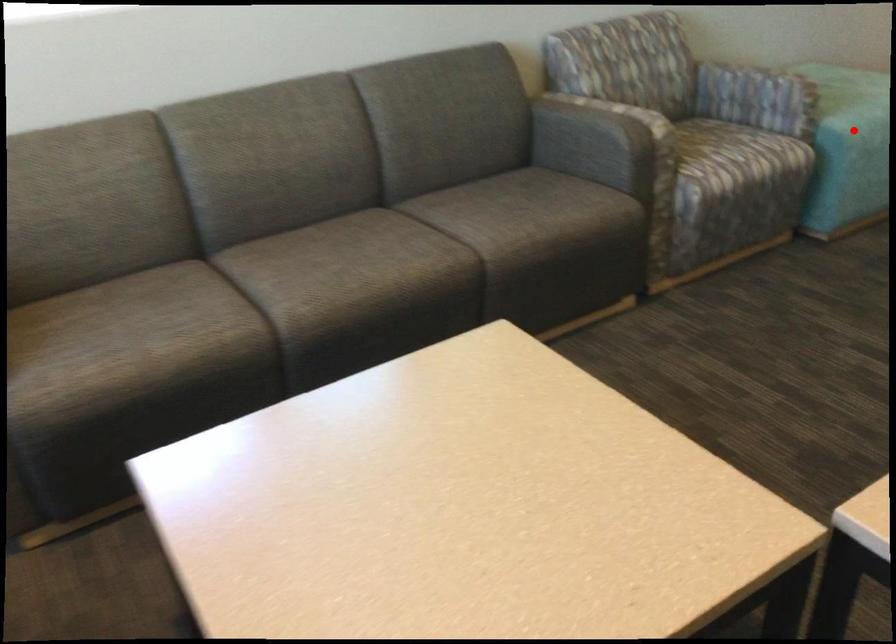
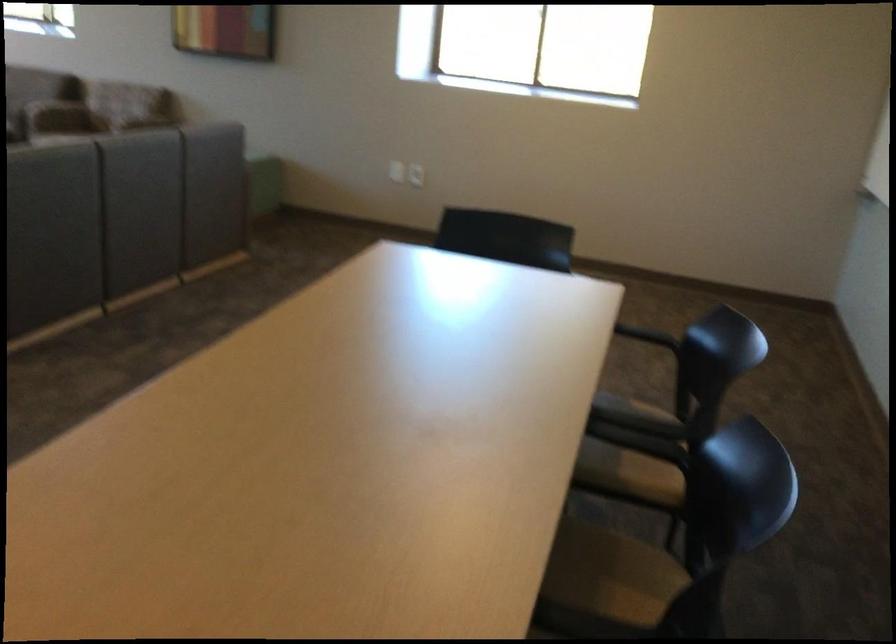
Question: I am providing you with two images of the same scene from different viewpoints. A red point is marked on the first image. Can you still see the location of the red point in image 2?

Choices:
 (A) Yes
 (B) No

Answer: (B)